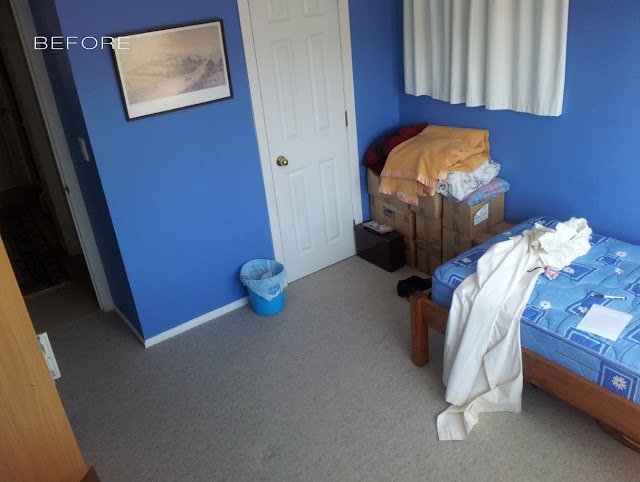
Find the location of a particular element. This screenshot has width=640, height=482. white trim is located at coordinates (191, 326), (132, 337), (99, 259).